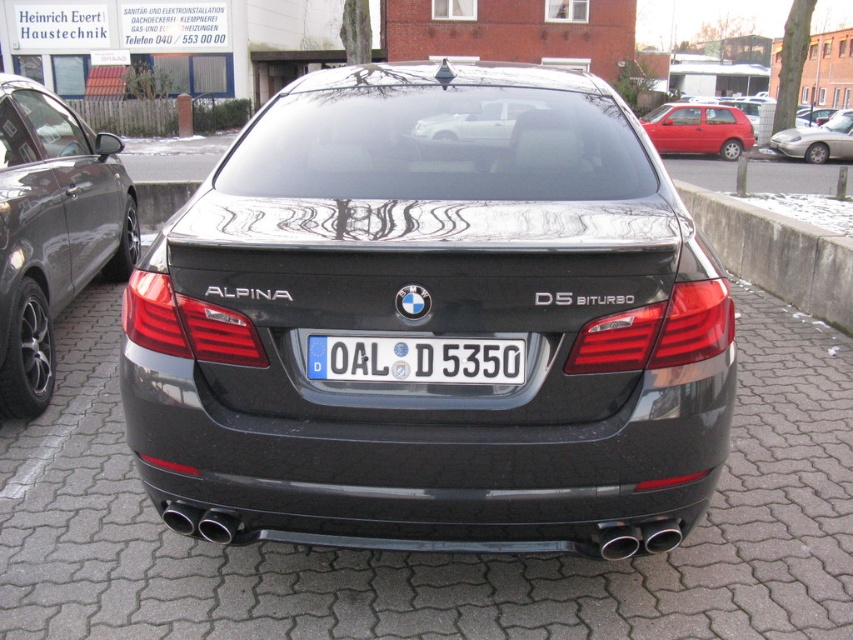
Between point (428, 173) and point (364, 348), which one is positioned behind?

Positioned behind is point (428, 173).

Who is more forward, (238, 458) or (492, 371)?

Positioned in front is point (492, 371).

I want to click on glossy black sedan at center, so click(x=432, y=324).

Can you confirm if glossy black sedan at center is bigger than metallic red hatchback at upper right?

Incorrect, glossy black sedan at center is not larger than metallic red hatchback at upper right.

Measure the distance between glossy black sedan at center and metallic red hatchback at upper right.

A distance of 22.24 meters exists between glossy black sedan at center and metallic red hatchback at upper right.

Locate an element on the screen. This screenshot has height=640, width=853. glossy black sedan at center is located at coordinates (432, 324).

Who is more distant from viewer, (666, 106) or (793, 136)?

Point (666, 106)

Can you confirm if metallic red hatchback at upper right is taller than silver metallic sports car at right?

In fact, metallic red hatchback at upper right may be shorter than silver metallic sports car at right.

Who is more distant from viewer, (718, 115) or (830, 129)?

Point (830, 129)

Identify the location of metallic red hatchback at upper right. This screenshot has height=640, width=853. [698, 129].